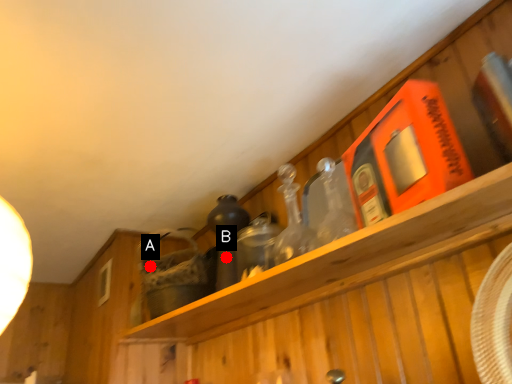
Question: Two points are circled on the image, labeled by A and B beside each circle. Which point appears farthest from the camera in this image?

Choices:
 (A) A is further
 (B) B is further

Answer: (A)